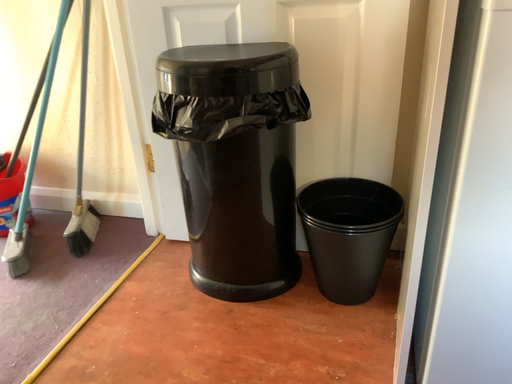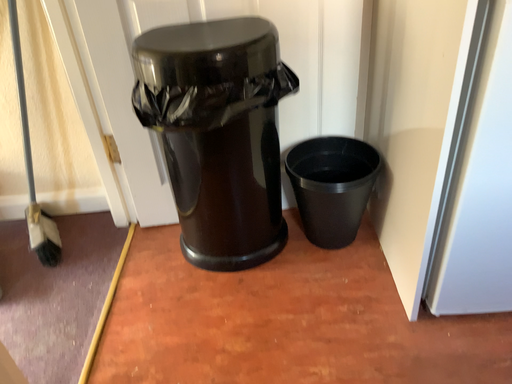
Question: How did the camera likely rotate when shooting the video?

Choices:
 (A) rotated left
 (B) rotated right

Answer: (B)